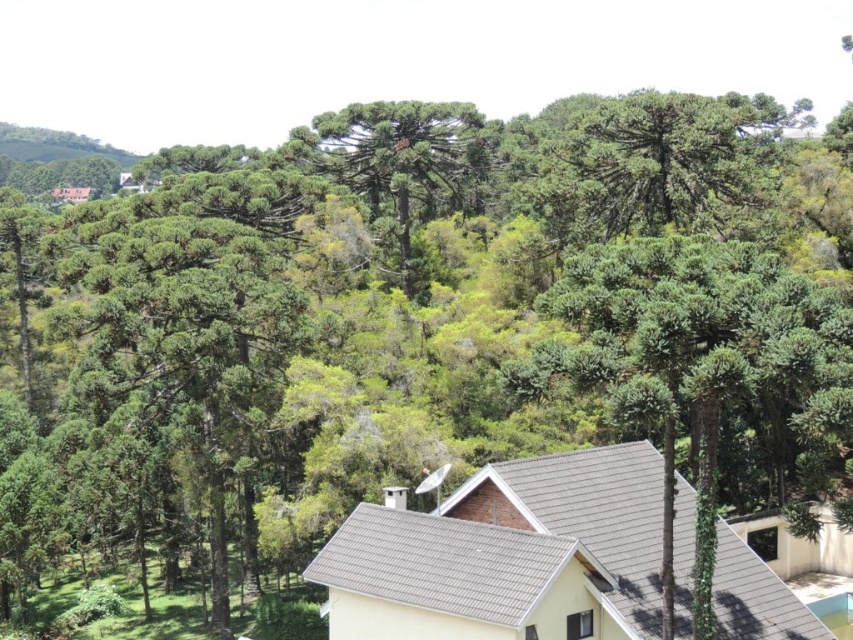
Question: Which object is closer to the camera taking this photo?

Choices:
 (A) green textured tree at center
 (B) green leafy tree at center

Answer: (B)

Question: Which point is closer to the camera?

Choices:
 (A) (738, 432)
 (B) (426, 164)

Answer: (A)

Question: Observing the image, what is the correct spatial positioning of green leafy tree at center in reference to green textured tree at center?

Choices:
 (A) left
 (B) right

Answer: (B)

Question: Which of the following is the farthest from the observer?

Choices:
 (A) green textured tree at center
 (B) green leafy tree at center

Answer: (A)

Question: Can you confirm if green leafy tree at center is positioned to the left of green textured tree at center?

Choices:
 (A) no
 (B) yes

Answer: (A)

Question: Does green leafy tree at center appear over green textured tree at center?

Choices:
 (A) yes
 (B) no

Answer: (B)